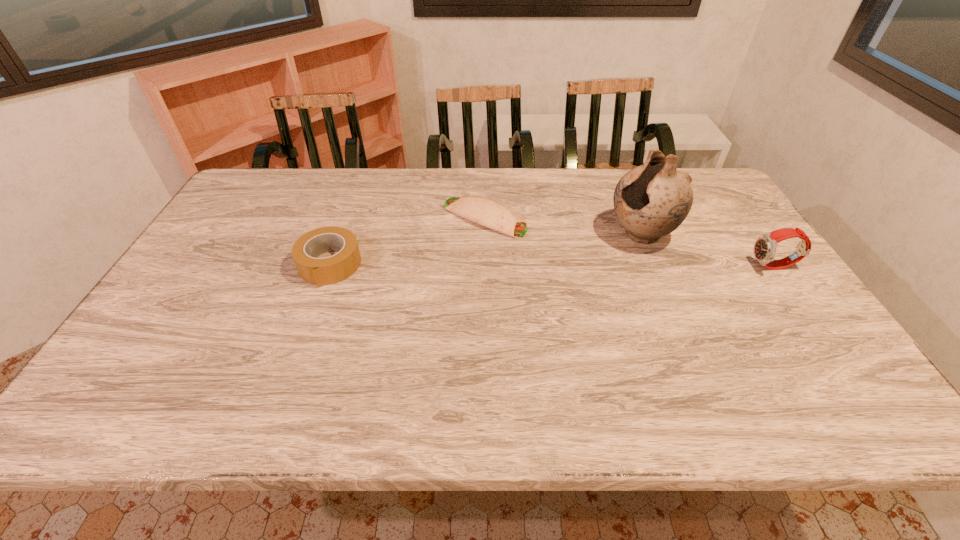
Identify the location of free space on the desktop that is between the second shortest object and the rightmost object and is positioned at the bitten end of the second object from left to right. The width and height of the screenshot is (960, 540). [604, 266].

You are a GUI agent. You are given a task and a screenshot of the screen. Output one action in this format:
    pyautogui.click(x=<x>, y=<y>)
    Task: Click on the free spot on the desktop that is between the second shortest object and the watch and is positioned from the spout of the third object from left to right
    This screenshot has width=960, height=540.
    Given the screenshot: What is the action you would take?
    pyautogui.click(x=565, y=266)